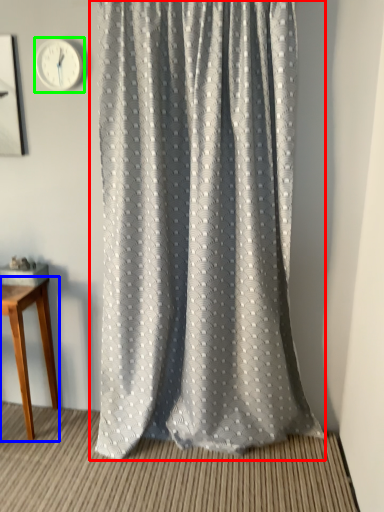
Question: Which object is positioned farthest from curtain (highlighted by a red box)? Select from table (highlighted by a blue box) and clock (highlighted by a green box).

Choices:
 (A) table
 (B) clock

Answer: (B)